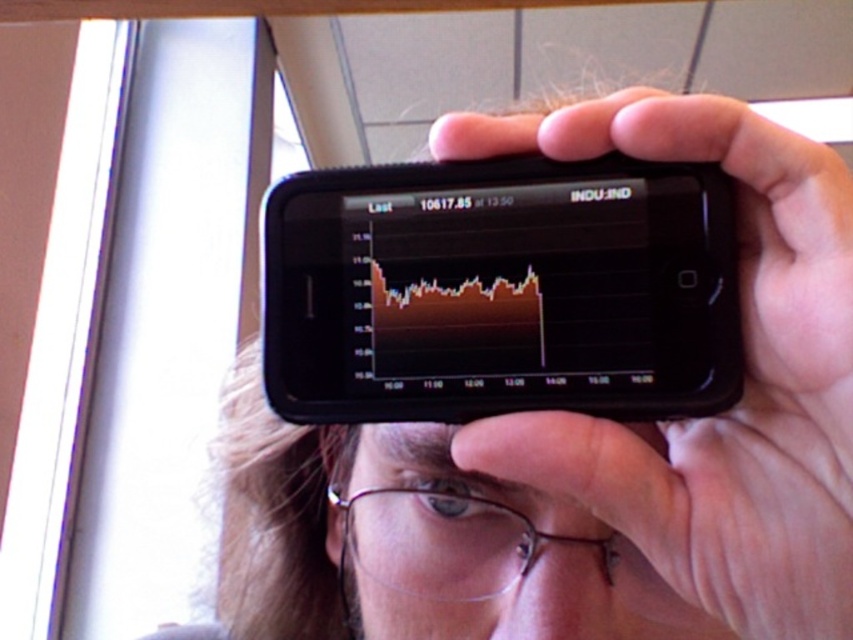
In the scene shown: You are analyzing the image of a person holding a smartphone. There are two points marked on the phone screen at coordinates point (473,262) and point (412,538). Which point is nearer to the viewer?

Point (473,262) is closer to the viewer than point (412,538).

You are trying to read the stock market graph on the black plastic smartphone at upper center while wearing the clear plastic glasses at center. Do you think the smartphone screen will be fully visible through your glasses?

The black plastic smartphone at upper center has a smaller size compared to clear plastic glasses at center, so the smartphone screen may not be fully visible through the glasses due to its smaller size.

Looking at this image, you are a delivery robot with a 10 cm wide package. You need to navigate through the space between the black matte phone at upper center and the clear plastic glasses at center. Can your package fit through the gap?

The distance between the black matte phone at upper center and the clear plastic glasses at center is 11.17 centimeters. Since the package is 10 cm wide, it can fit through the gap as the space is wider than the package.